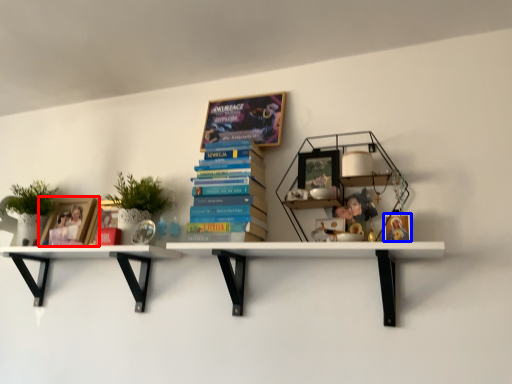
Question: Among these objects, which one is nearest to the camera, book cover (highlighted by a red box) or book cover (highlighted by a blue box)?

Choices:
 (A) book cover
 (B) book cover

Answer: (B)